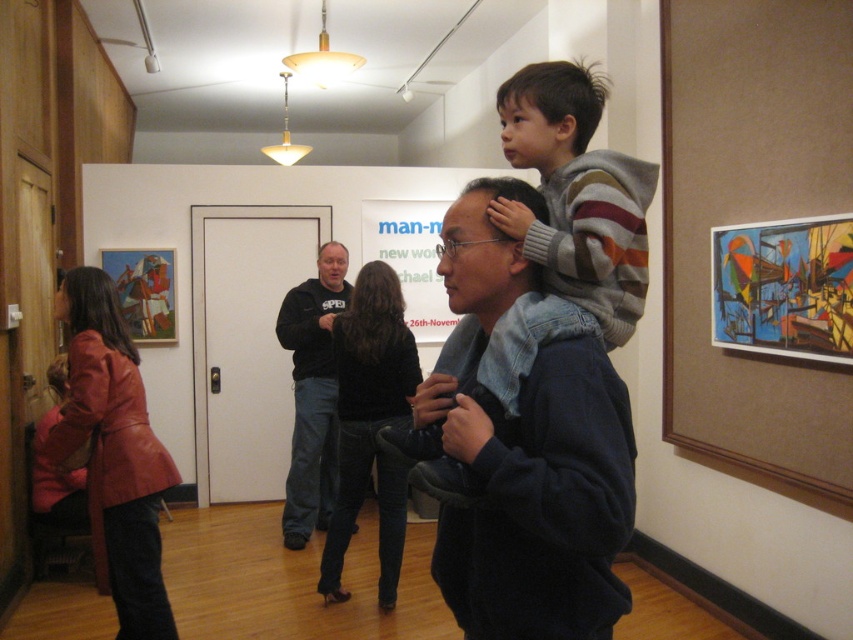
Question: Which object is positioned farthest from the leather jacket at lower left?

Choices:
 (A) black soft jacket at center
 (B) black leather jacket at center
 (C) striped sweater at center

Answer: (C)

Question: Which point is farther to the camera?

Choices:
 (A) leather jacket at lower left
 (B) striped sweater at center
 (C) black leather jacket at center

Answer: (C)

Question: Can you confirm if black leather jacket at center is positioned to the left of black soft jacket at center?

Choices:
 (A) yes
 (B) no

Answer: (B)

Question: Considering the relative positions of striped sweater at center and black soft jacket at center in the image provided, where is striped sweater at center located with respect to black soft jacket at center?

Choices:
 (A) left
 (B) right

Answer: (B)

Question: From the image, what is the correct spatial relationship of leather jacket at lower left in relation to black leather jacket at center?

Choices:
 (A) below
 (B) above

Answer: (A)

Question: Considering the real-world distances, which object is closest to the striped sweater at center?

Choices:
 (A) black leather jacket at center
 (B) leather jacket at lower left
 (C) black soft jacket at center

Answer: (B)